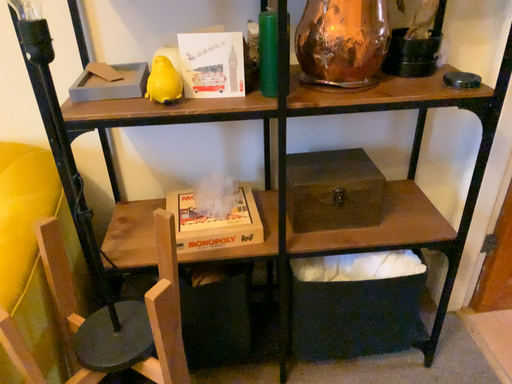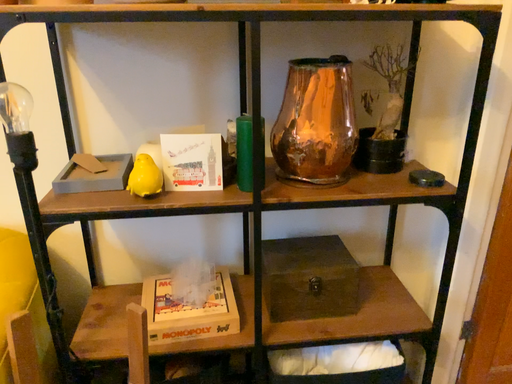
Question: Which way did the camera rotate in the video?

Choices:
 (A) rotated upward
 (B) rotated downward

Answer: (A)